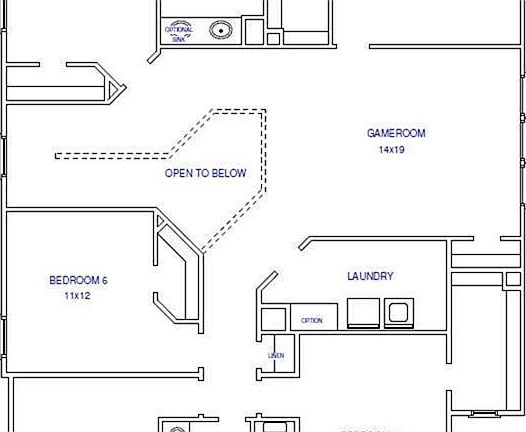
Where is `room`? Image resolution: width=526 pixels, height=432 pixels. room is located at coordinates (471, 332).